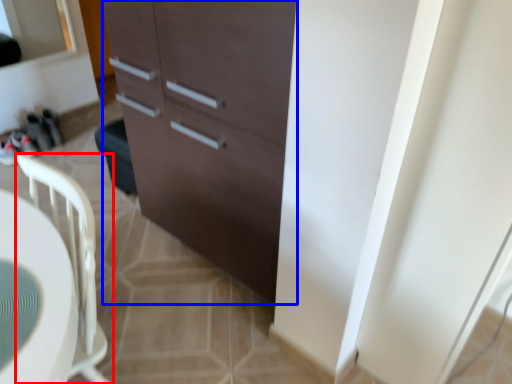
Question: Which point is closer to the camera, chair (highlighted by a red box) or cabinetry (highlighted by a blue box)?

Choices:
 (A) chair
 (B) cabinetry

Answer: (A)